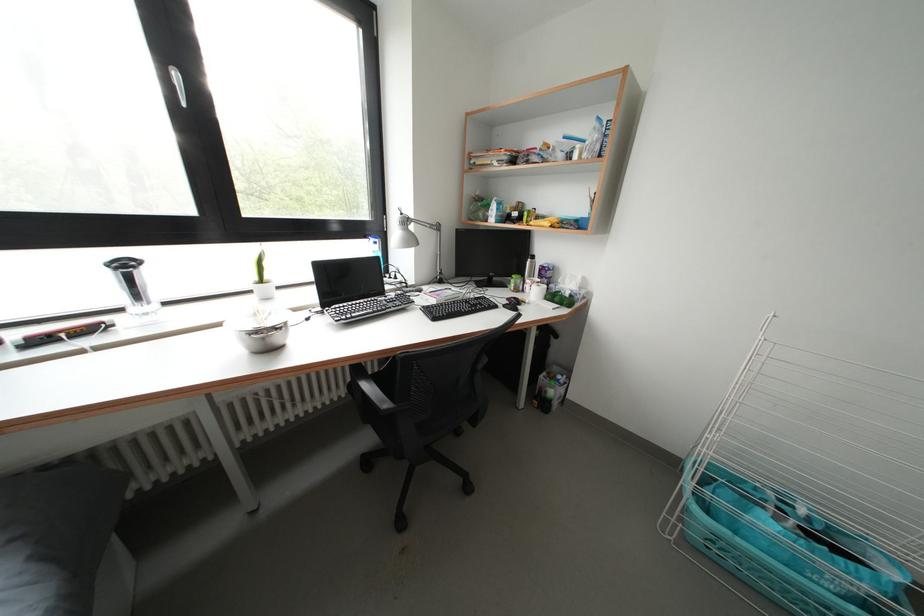
I want to click on black chair armrest, so click(x=377, y=397).